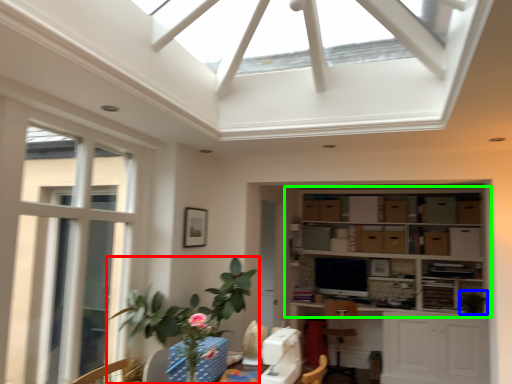
Question: Estimate the real-world distances between objects in this image. Which object is closer to houseplant (highlighted by a red box), plant (highlighted by a blue box) or shelf (highlighted by a green box)?

Choices:
 (A) plant
 (B) shelf

Answer: (B)